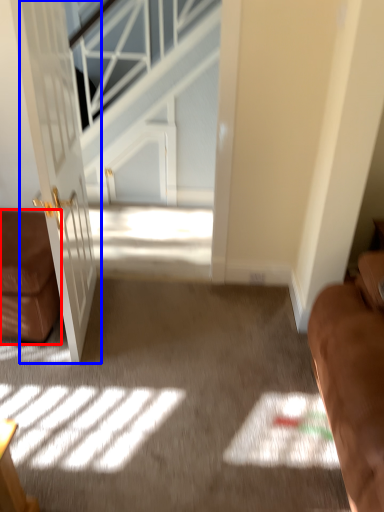
Question: Which of the following is the farthest to the observer, furniture (highlighted by a red box) or door (highlighted by a blue box)?

Choices:
 (A) furniture
 (B) door

Answer: (A)